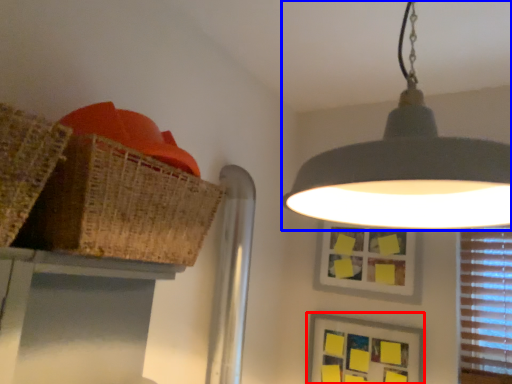
Question: Which of the following is the closest to the observer, picture frame (highlighted by a red box) or lamp (highlighted by a blue box)?

Choices:
 (A) picture frame
 (B) lamp

Answer: (B)